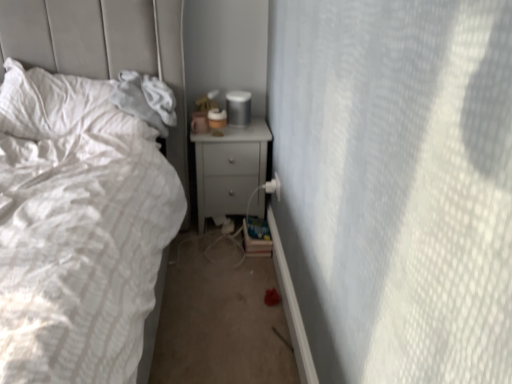
The height and width of the screenshot is (384, 512). Identify the location of white textured pillow at left. (61, 106).

The image size is (512, 384). What do you see at coordinates (229, 168) in the screenshot?
I see `matte gray nightstand at center` at bounding box center [229, 168].

In order to face matte plastic cup at upper right, should I rotate leftwards or rightwards?

A 2.173 degree turn to the left will do.

The image size is (512, 384). Find the location of `matte plastic cup at upper right`. matte plastic cup at upper right is located at coordinates (238, 107).

Where is `white textured pillow at left`? white textured pillow at left is located at coordinates (61, 106).

In the scene shown: Is white textured pillow at left surrounded by matte plastic cup at upper right?

That's incorrect, white textured pillow at left is not inside matte plastic cup at upper right.

Based on their sizes in the image, would you say matte plastic cup at upper right is bigger or smaller than white textured pillow at left?

Considering their sizes, matte plastic cup at upper right takes up less space than white textured pillow at left.

From the image's perspective, would you say matte plastic cup at upper right is positioned over white textured pillow at left?

Yes, from the image's perspective, matte plastic cup at upper right is above white textured pillow at left.

Measure the distance from matte plastic cup at upper right to white textured pillow at left.

29.57 inches.

Does matte gray nightstand at center turn towards matte plastic cup at upper right?

No, matte gray nightstand at center is not turned towards matte plastic cup at upper right.

Is matte gray nightstand at center thinner than matte plastic cup at upper right?

Incorrect, the width of matte gray nightstand at center is not less than that of matte plastic cup at upper right.

Would you consider matte gray nightstand at center to be distant from matte plastic cup at upper right?

No, matte gray nightstand at center is in close proximity to matte plastic cup at upper right.

Which is behind, matte gray nightstand at center or matte plastic cup at upper right?

matte plastic cup at upper right is behind.

Considering the relative positions of matte gray nightstand at center and white textured pillow at left in the image provided, is matte gray nightstand at center to the left or to the right of white textured pillow at left?

matte gray nightstand at center is positioned on white textured pillow at left's right side.

This screenshot has width=512, height=384. Find the location of `pillow that appears on the left of matte gray nightstand at center`. pillow that appears on the left of matte gray nightstand at center is located at coordinates (61, 106).

Is point (229, 179) closer or farther from the camera than point (71, 130)?

Point (229, 179) is farther from the camera than point (71, 130).

Choose the correct answer: Is white textured pillow at left inside matte plastic cup at upper right or outside it?

white textured pillow at left cannot be found inside matte plastic cup at upper right.

Looking at this image, between white textured pillow at left and matte plastic cup at upper right, which one has larger width?

With larger width is white textured pillow at left.

In the scene shown: Which of these two, white textured pillow at left or matte plastic cup at upper right, is smaller?

With smaller size is matte plastic cup at upper right.

Is white textured pillow at left placed right next to matte plastic cup at upper right?

No, white textured pillow at left is not with matte plastic cup at upper right.

From a real-world perspective, is matte plastic cup at upper right positioned under matte gray nightstand at center based on gravity?

No, from a real-world perspective, matte plastic cup at upper right is not beneath matte gray nightstand at center.

How distant is matte plastic cup at upper right from matte gray nightstand at center?

The distance of matte plastic cup at upper right from matte gray nightstand at center is 10.74 inches.

Considering the positions of objects matte plastic cup at upper right and matte gray nightstand at center in the image provided, who is more to the right, matte plastic cup at upper right or matte gray nightstand at center?

matte plastic cup at upper right.

Does matte plastic cup at upper right have a lesser height compared to matte gray nightstand at center?

Indeed, matte plastic cup at upper right has a lesser height compared to matte gray nightstand at center.

Considering the relative sizes of white textured pillow at left and matte gray nightstand at center in the image provided, is white textured pillow at left bigger than matte gray nightstand at center?

Correct, white textured pillow at left is larger in size than matte gray nightstand at center.

Would you say matte gray nightstand at center is part of white textured pillow at left's contents?

No, matte gray nightstand at center is located outside of white textured pillow at left.

From the picture: Considering the positions of objects white textured pillow at left and matte gray nightstand at center in the image provided, who is more to the right, white textured pillow at left or matte gray nightstand at center?

matte gray nightstand at center.

Would you say white textured pillow at left is a long distance from matte gray nightstand at center?

No, there isn't a large distance between white textured pillow at left and matte gray nightstand at center.

This screenshot has width=512, height=384. In order to click on gray lying on the right of white textured pillow at left in this screenshot , I will do `click(238, 107)`.

Where is `nightstand in front of the matte plastic cup at upper right`? This screenshot has width=512, height=384. nightstand in front of the matte plastic cup at upper right is located at coordinates (229, 168).

Considering their positions, is matte gray nightstand at center positioned further to matte plastic cup at upper right than white textured pillow at left?

white textured pillow at left lies further to matte plastic cup at upper right than the other object.

Considering their positions, is matte plastic cup at upper right positioned closer to matte gray nightstand at center than white textured pillow at left?

matte plastic cup at upper right is closer to matte gray nightstand at center.

Based on the photo, from the image, which object appears to be nearer to matte gray nightstand at center, white textured pillow at left or matte plastic cup at upper right?

matte plastic cup at upper right is closer to matte gray nightstand at center.

From the image, which object appears to be farther from white textured pillow at left, matte gray nightstand at center or matte plastic cup at upper right?

The object further to white textured pillow at left is matte plastic cup at upper right.

Considering their positions, is matte plastic cup at upper right positioned further to white textured pillow at left than matte gray nightstand at center?

matte plastic cup at upper right is further to white textured pillow at left.

Estimate the real-world distances between objects in this image. Which object is further from matte plastic cup at upper right, white textured pillow at left or matte gray nightstand at center?

white textured pillow at left lies further to matte plastic cup at upper right than the other object.

You are a GUI agent. You are given a task and a screenshot of the screen. Output one action in this format:
    pyautogui.click(x=<x>, y=<y>)
    Task: Click on the nightstand located between white textured pillow at left and matte plastic cup at upper right in the left-right direction
    
    Given the screenshot: What is the action you would take?
    pyautogui.click(x=229, y=168)